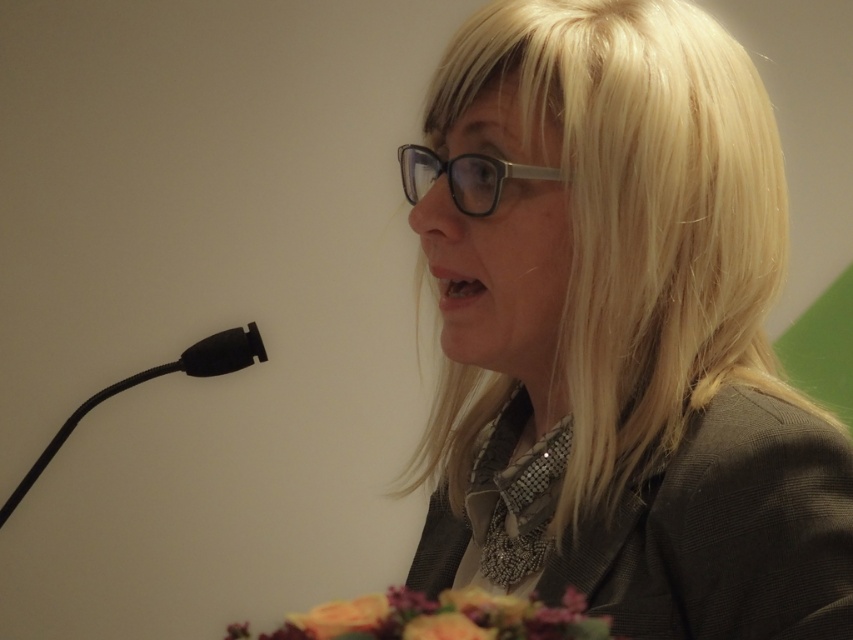
Measure the distance between floral bouquet at lower center and black matte microphone at left.

floral bouquet at lower center and black matte microphone at left are 27.02 inches apart from each other.

Does floral bouquet at lower center lie in front of black matte microphone at left?

Yes, it is.

The height and width of the screenshot is (640, 853). Find the location of `floral bouquet at lower center`. floral bouquet at lower center is located at coordinates (444, 618).

Locate an element on the screen. floral bouquet at lower center is located at coordinates (444, 618).

Where is `blonde silky hair at center`? Image resolution: width=853 pixels, height=640 pixels. blonde silky hair at center is located at coordinates (641, 216).

Between point (642, 204) and point (488, 628), which one is positioned behind?

The point (642, 204) is behind.

Which is behind, point (711, 20) or point (276, 628)?

Positioned behind is point (711, 20).

In order to click on blonde silky hair at center in this screenshot , I will do `click(641, 216)`.

Who is more distant from viewer, (703,74) or (189,374)?

Positioned behind is point (189,374).

Consider the image. Measure the distance between blonde silky hair at center and camera.

blonde silky hair at center is 22.26 inches from camera.

At what (x,y) coordinates should I click in order to perform the action: click on blonde silky hair at center. Please return your answer as a coordinate pair (x, y). This screenshot has height=640, width=853. Looking at the image, I should click on pyautogui.click(x=641, y=216).